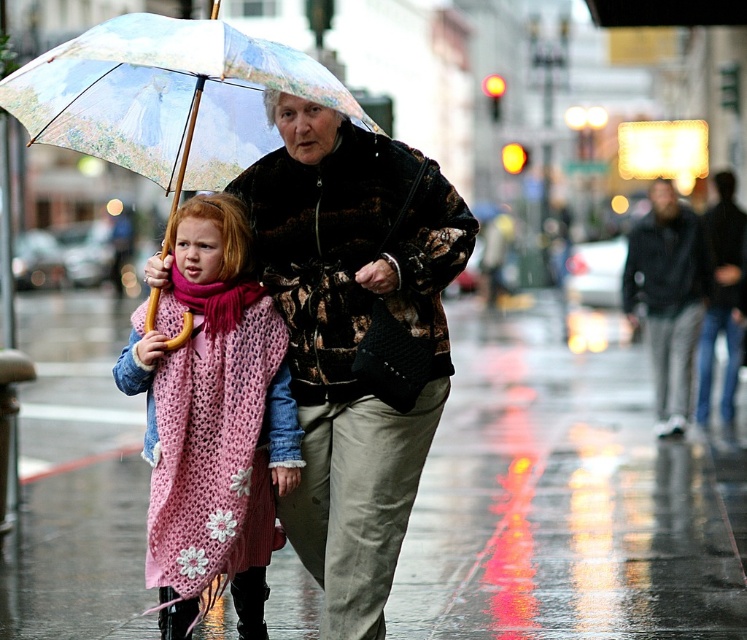
Question: Is pink knitted scarf at lower left wider than floral-patterned coat at center?

Choices:
 (A) yes
 (B) no

Answer: (A)

Question: Which is farther from the printed fabric umbrella at center?

Choices:
 (A) dark gray jeans at right
 (B) floral-patterned coat at center
 (C) pink knitted scarf at lower left

Answer: (C)

Question: Which point is closer to the camera taking this photo?

Choices:
 (A) (257, 257)
 (B) (214, 26)

Answer: (B)

Question: Is pink knitted scarf at lower left bigger than pink knitted shawl at left?

Choices:
 (A) no
 (B) yes

Answer: (B)

Question: Which point appears farthest from the camera in this image?

Choices:
 (A) (462, 250)
 (B) (675, 262)
 (C) (247, 164)

Answer: (B)

Question: Observing the image, what is the correct spatial positioning of pink knitted scarf at lower left in reference to dark gray jeans at right?

Choices:
 (A) below
 (B) above

Answer: (A)